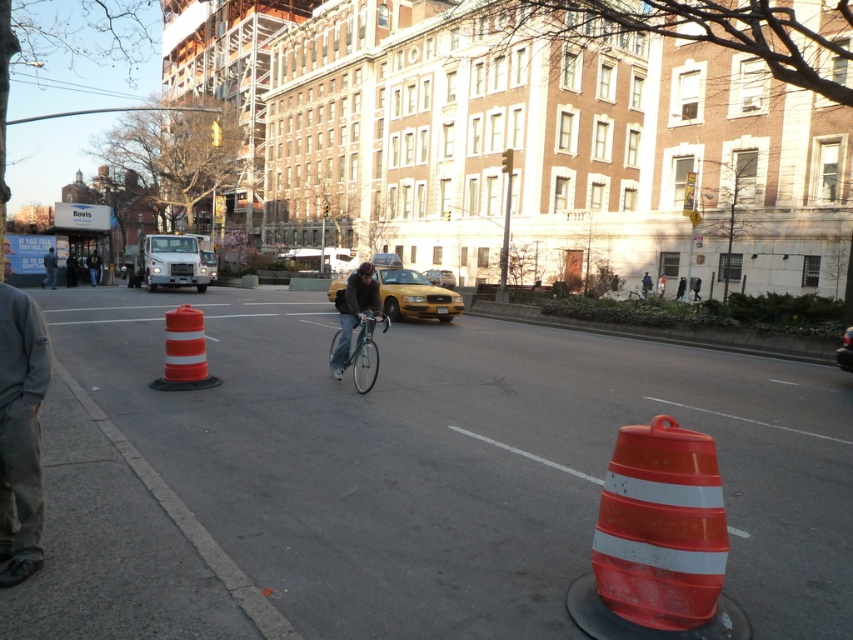
Question: Which point is farther from the camera taking this photo?

Choices:
 (A) [53, 259]
 (B) [349, 355]
 (C) [770, 432]
 (D) [15, 340]

Answer: (A)

Question: Can you confirm if orange reflective cone at center is smaller than dark gray pants at lower left?

Choices:
 (A) no
 (B) yes

Answer: (A)

Question: Is orange reflective cone at center to the left of teal metallic bicycle at center from the viewer's perspective?

Choices:
 (A) no
 (B) yes

Answer: (B)

Question: Based on their relative distances, which object is farther from the orange reflective cone at center?

Choices:
 (A) orange reflective traffic cone at center
 (B) dark gray jacket at center

Answer: (B)

Question: Which is nearer to the orange reflective traffic cone at center?

Choices:
 (A) teal metallic bicycle at center
 (B) orange reflective traffic cone at lower right
 (C) dark gray pants at lower left
 (D) dark gray jacket at center

Answer: (A)

Question: Is orange reflective traffic cone at center smaller than dark gray jacket at center?

Choices:
 (A) no
 (B) yes

Answer: (B)